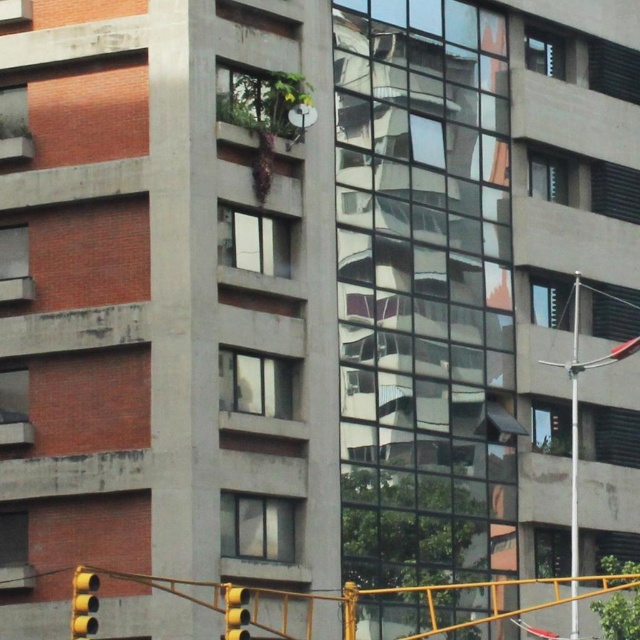
Question: Which point is farther to the camera?

Choices:
 (A) (237, 637)
 (B) (88, 579)
 (C) (577, 593)

Answer: (C)

Question: Can you confirm if metallic pole at right is positioned to the right of yellow matte traffic light at lower left?

Choices:
 (A) yes
 (B) no

Answer: (A)

Question: Can you confirm if yellow matte traffic light at lower left is smaller than yellow matte traffic light at lower center?

Choices:
 (A) yes
 (B) no

Answer: (B)

Question: Which object appears closest to the camera in this image?

Choices:
 (A) metallic pole at right
 (B) yellow matte traffic light at lower center
 (C) yellow matte traffic light at lower left

Answer: (B)

Question: Among these objects, which one is nearest to the camera?

Choices:
 (A) metallic pole at right
 (B) yellow matte traffic light at lower center
 (C) yellow matte traffic light at lower left

Answer: (B)

Question: Considering the relative positions of metallic pole at right and yellow matte traffic light at lower center in the image provided, where is metallic pole at right located with respect to yellow matte traffic light at lower center?

Choices:
 (A) left
 (B) right

Answer: (B)